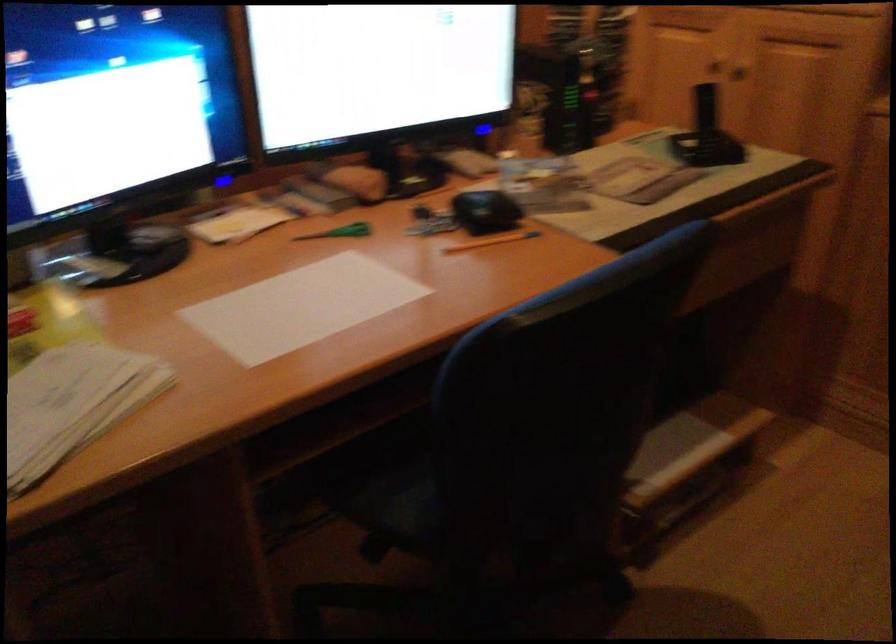
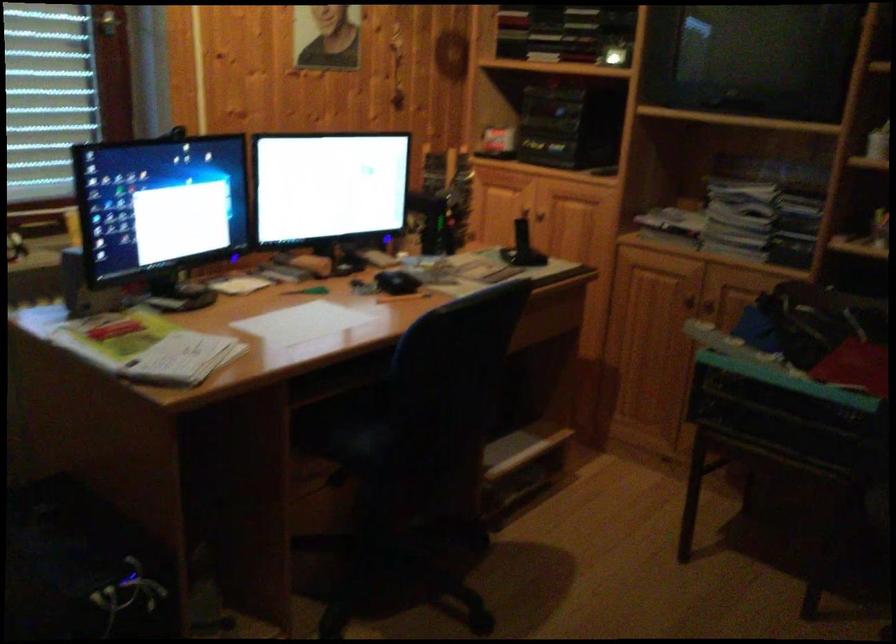
Question: How did the camera likely rotate?

Choices:
 (A) Left
 (B) Right
 (C) Up
 (D) Down

Answer: (B)